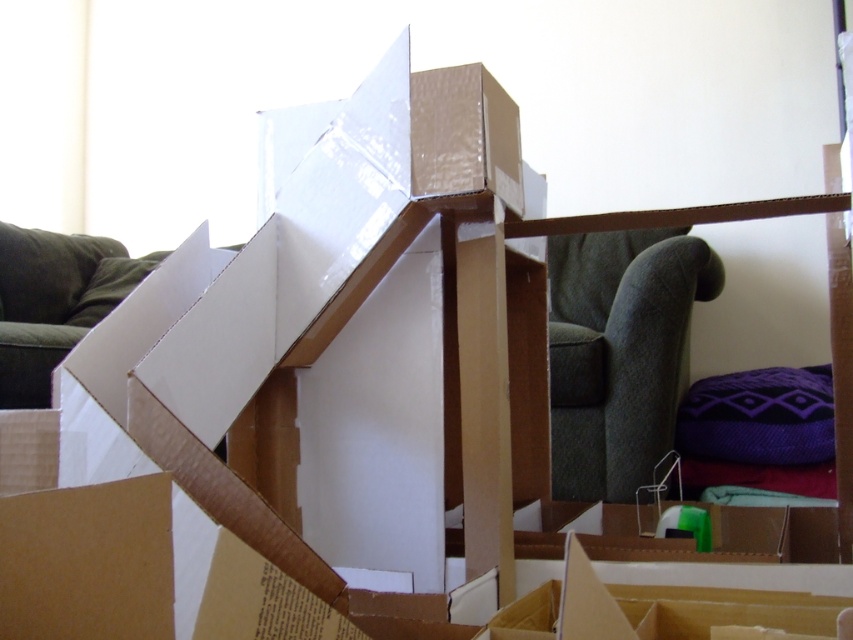
You are standing in the living room and want to sit down. Which furniture item, the dark green fabric armchair at center or the green fabric couch at left, is closer to you?

The dark green fabric armchair at center is closer to the viewer than the green fabric couch at left, so you should choose the dark green fabric armchair at center to sit down.

You are standing in the living room and want to place a new sofa that is 1.8 meters wide. The sofa needs to be placed in a position that is not overlapping with any existing furniture. Given the dark green fabric armchair at center, where should you position the sofa to ensure it doesn not overlap?

The dark green fabric armchair at center is located at point [619,353]. To avoid overlapping, the sofa should be placed in an area of the room that is not occupied by the armchair, such as near the walls or in an open space away from the armchair.

You are moving into a new apartment and need to place a 1.5 meter long sofa in the living room. You see the dark green fabric armchair at center and the green fabric couch at left. Can you fit the sofa between them without overlapping?

The dark green fabric armchair at center is 1.83 meters away from the green fabric couch at left. Since the sofa is 1.5 meters long, it can fit between them as the distance between the two pieces of furniture is greater than the sofa length.